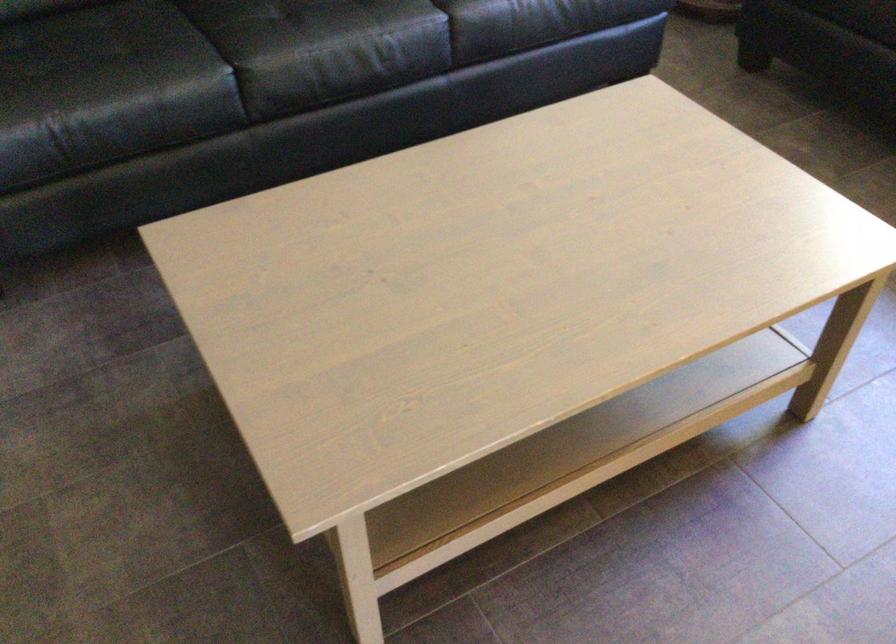
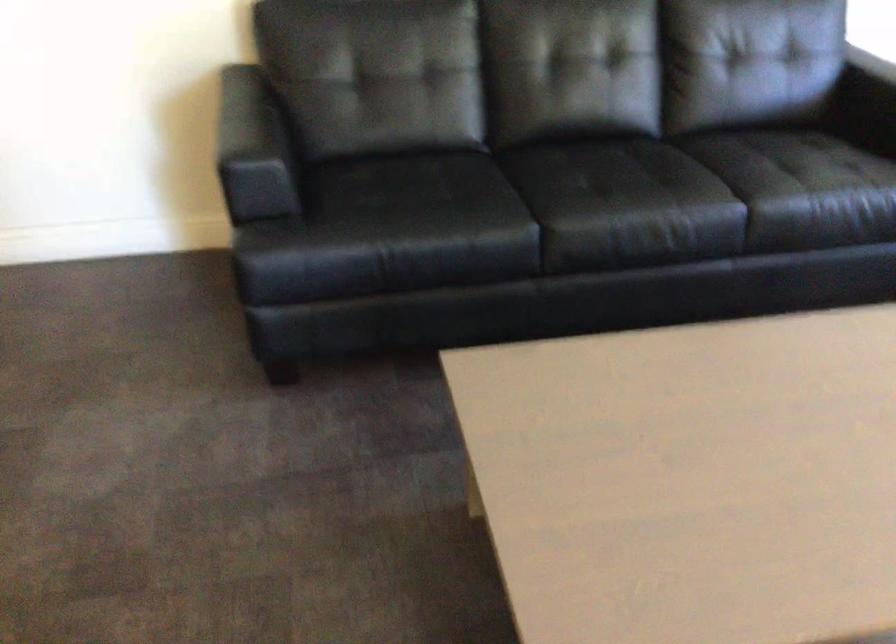
Question: The camera is either moving clockwise (left) or counter-clockwise (right) around the object. The first image is from the beginning of the video and the second image is from the end. Is the camera moving left or right when shooting the video?

Choices:
 (A) Left
 (B) Right

Answer: (B)